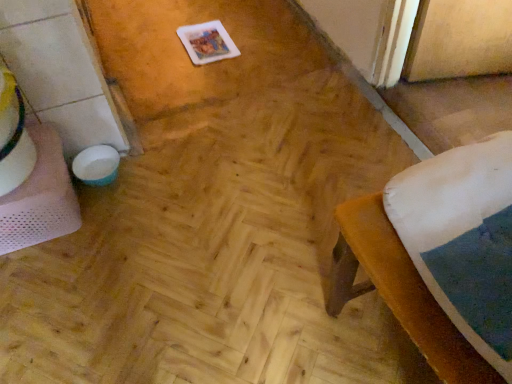
This screenshot has height=384, width=512. What are the coordinates of `vacant space situated on the left part of brown fabric stool at lower right` in the screenshot? It's located at (262, 294).